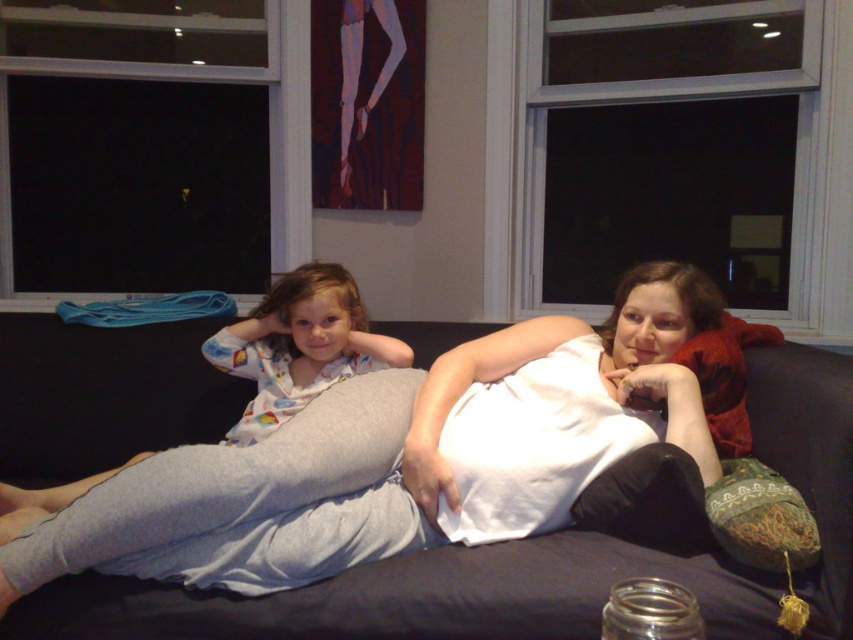
Question: Can you confirm if light gray cotton pajama pants at left is bigger than white cotton pajamas at center?

Choices:
 (A) yes
 (B) no

Answer: (A)

Question: Is dark gray fabric couch at center to the right of light gray cotton pajama pants at left from the viewer's perspective?

Choices:
 (A) no
 (B) yes

Answer: (B)

Question: Estimate the real-world distances between objects in this image. Which object is farther from the white cotton pajamas at center?

Choices:
 (A) light gray cotton pajama pants at left
 (B) dark gray fabric couch at center

Answer: (B)

Question: Is dark gray fabric couch at center above light gray cotton pajama pants at left?

Choices:
 (A) yes
 (B) no

Answer: (B)

Question: Which point is closer to the camera?

Choices:
 (A) (537, 589)
 (B) (340, 321)
 (C) (247, 422)

Answer: (A)

Question: Which object is positioned closest to the light gray cotton pajama pants at left?

Choices:
 (A) white cotton pajamas at center
 (B) dark gray fabric couch at center

Answer: (A)